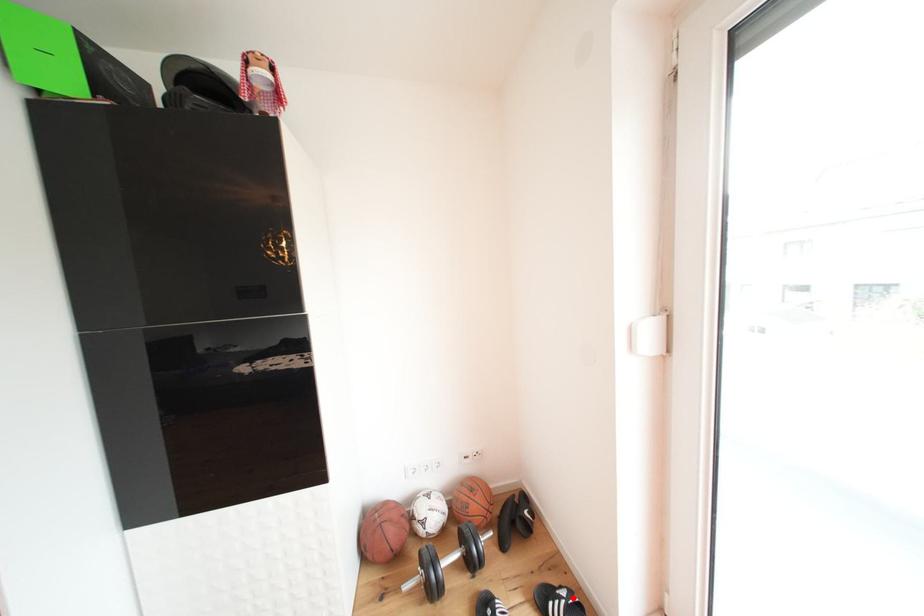
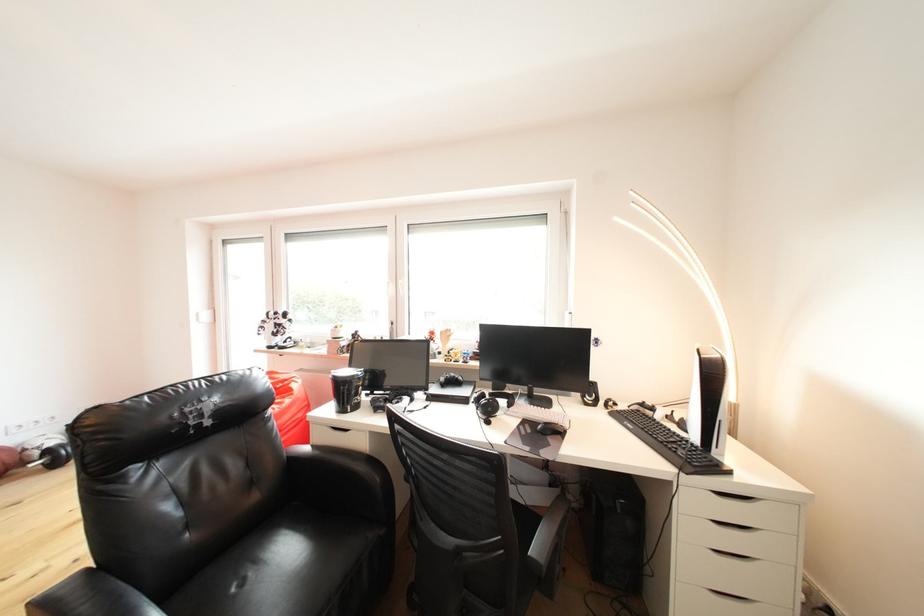
Question: I am providing you with two images of the same scene from different viewpoints. A red point is marked on the first image. At the location where the point appears in image 1, is it still visible in image 2?

Choices:
 (A) Yes
 (B) No

Answer: (B)